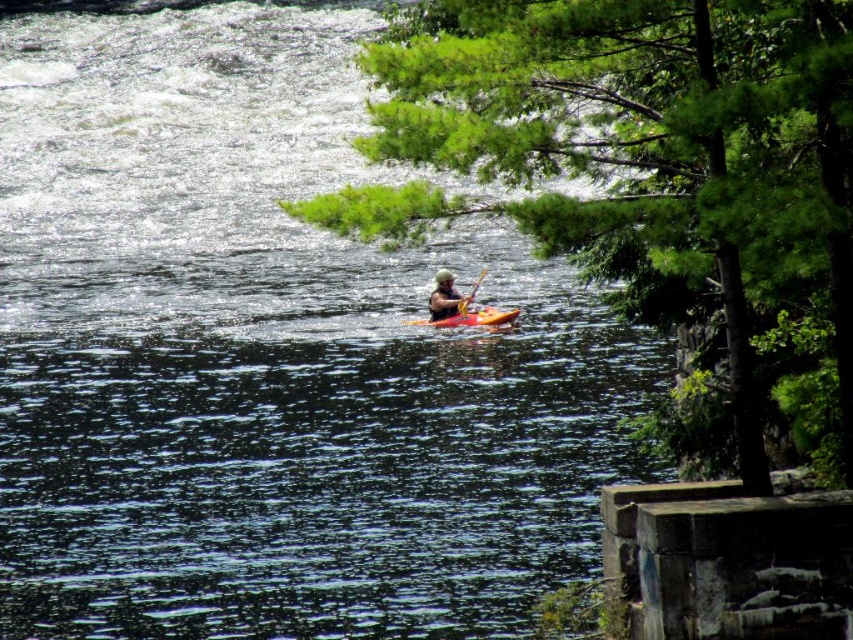
Looking at this image, between matte green helmet at center and yellow wood paddle at center, which one appears on the right side from the viewer's perspective?

From the viewer's perspective, yellow wood paddle at center appears more on the right side.

How distant is matte green helmet at center from yellow wood paddle at center?

matte green helmet at center and yellow wood paddle at center are 12.01 inches apart from each other.

This screenshot has height=640, width=853. Identify the location of matte green helmet at center. (445, 296).

Find the location of a particular element. The image size is (853, 640). matte green helmet at center is located at coordinates (445, 296).

Does green leafy tree at upper right appear on the left side of orange matte kayak at center?

Incorrect, green leafy tree at upper right is not on the left side of orange matte kayak at center.

Between green leafy tree at upper right and orange matte kayak at center, which one appears on the left side from the viewer's perspective?

orange matte kayak at center is more to the left.

Which is behind, point (590, 1) or point (494, 308)?

Positioned behind is point (494, 308).

Locate an element on the screen. green leafy tree at upper right is located at coordinates (637, 152).

Can you confirm if orange matte kayak at center is taller than yellow wood paddle at center?

No.

Measure the distance between point (508, 310) and camera.

They are 112.35 feet apart.

Is point (503, 320) closer to viewer compared to point (469, 292)?

Yes, point (503, 320) is in front of point (469, 292).

Locate an element on the screen. This screenshot has width=853, height=640. orange matte kayak at center is located at coordinates (473, 317).